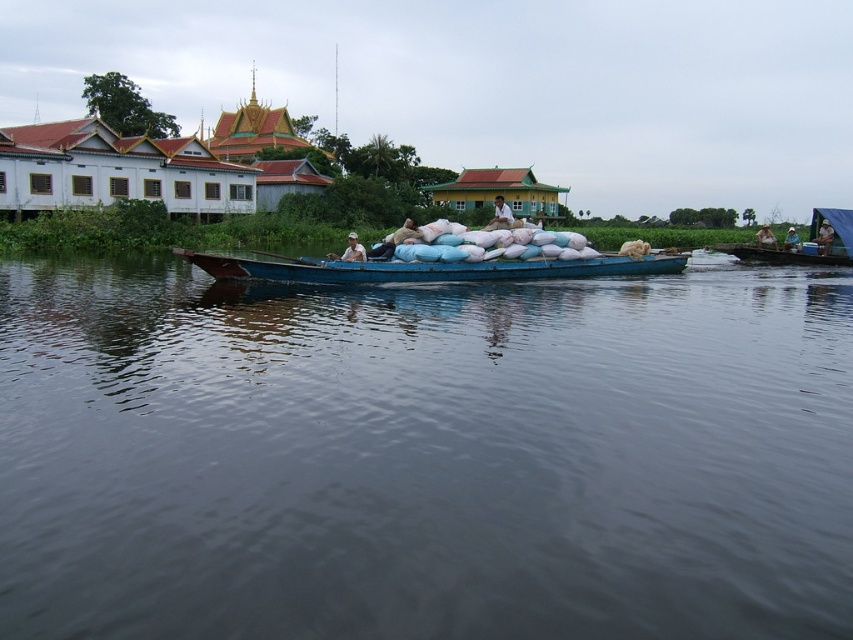
Question: Is blue wooden canoe at right above light brown wooden boat at right?

Choices:
 (A) yes
 (B) no

Answer: (A)

Question: Can you confirm if blue matte canoe at center is positioned above brown woven hat at center?

Choices:
 (A) no
 (B) yes

Answer: (A)

Question: Which point is closer to the camera?

Choices:
 (A) (793, 237)
 (B) (350, 253)

Answer: (B)

Question: Which object is positioned closest to the light brown wooden boat at right?

Choices:
 (A) brown woven hat at center
 (B) white fabric shirt at center
 (C) white fabric hat at center

Answer: (A)

Question: Is blue wooden canoe at right wider than white fabric hat at center?

Choices:
 (A) no
 (B) yes

Answer: (B)

Question: Which of the following is the farthest from the observer?

Choices:
 (A) (x=497, y=205)
 (B) (x=766, y=234)
 (C) (x=822, y=220)
 (D) (x=761, y=260)

Answer: (B)